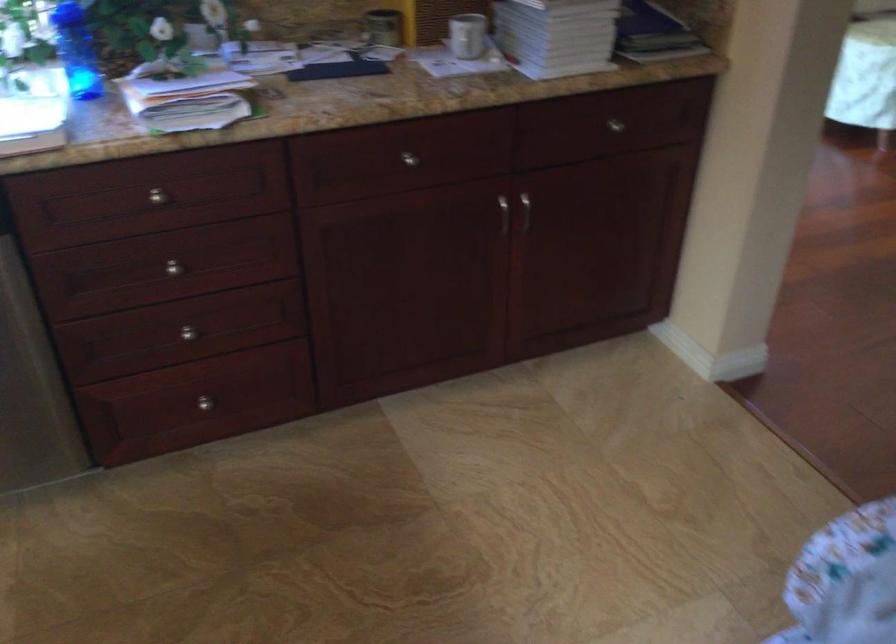
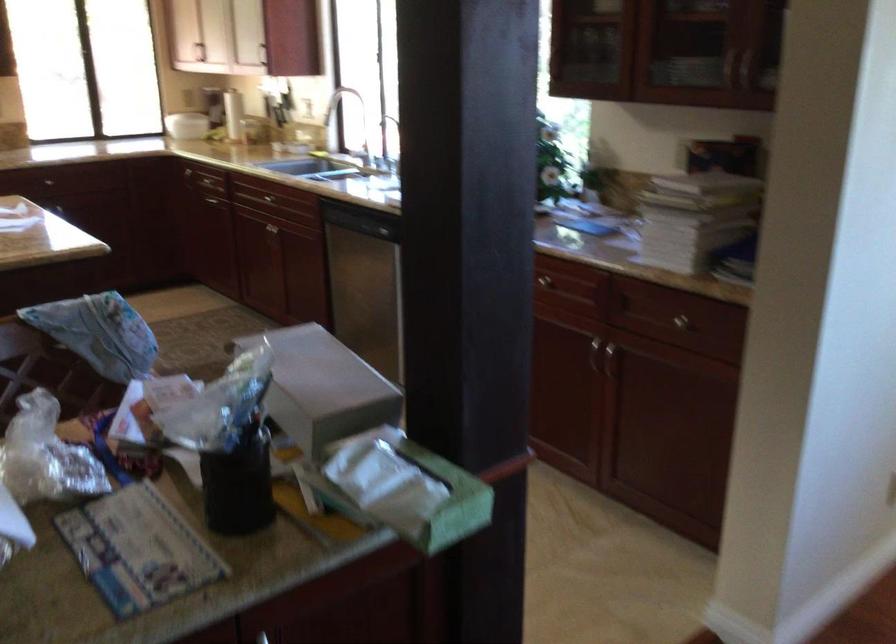
Question: I am providing you with two images of the same scene from different viewpoints. Please identify which objects are invisible in image2.

Choices:
 (A) silver wall clock
 (B) silver drawer knob
 (C) dark glass bottle
 (D) metal cabinet handle

Answer: (B)